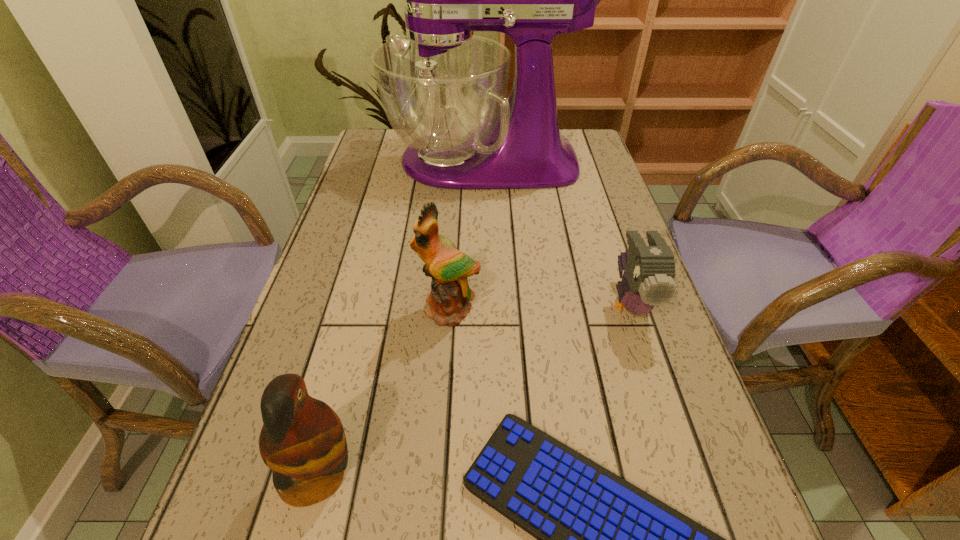
In the image, there is a desktop. Where is `free space at the far left corner`? This screenshot has height=540, width=960. free space at the far left corner is located at coordinates (372, 156).

At what (x,y) coordinates should I click in order to perform the action: click on free spot between the left parrot and the right parrot. Please return your answer as a coordinate pair (x, y). Image resolution: width=960 pixels, height=540 pixels. Looking at the image, I should click on (383, 392).

Where is `free area in between the bird and the farther parrot`? This screenshot has width=960, height=540. free area in between the bird and the farther parrot is located at coordinates (540, 307).

The width and height of the screenshot is (960, 540). What are the coordinates of `free spot between the farthest object and the nearer parrot` in the screenshot? It's located at (400, 318).

I want to click on free space that is in between the farther parrot and the left parrot, so click(x=383, y=392).

This screenshot has width=960, height=540. In order to click on free spot between the farthest object and the fourth tallest object in this screenshot , I will do `click(557, 232)`.

Find the location of a particular element. The width and height of the screenshot is (960, 540). free point between the bird and the left parrot is located at coordinates (474, 389).

I want to click on the second closest object to the mixer, so click(447, 303).

At what (x,y) coordinates should I click in order to perform the action: click on object that is the second closest to the shortest object. Please return your answer as a coordinate pair (x, y). Image resolution: width=960 pixels, height=540 pixels. Looking at the image, I should click on (649, 271).

I want to click on free space that satisfies the following two spatial constraints: 1. at the beak of the bird; 2. on the face of the left parrot, so click(687, 475).